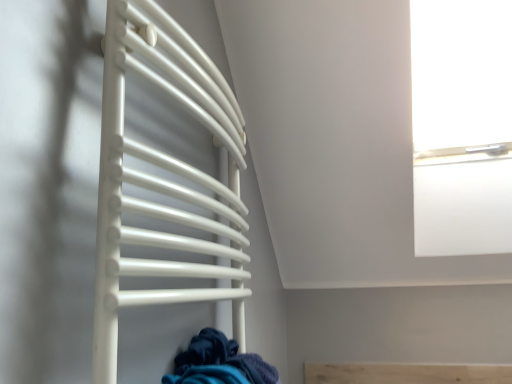
This screenshot has height=384, width=512. I want to click on white glossy towel rack at left, so click(x=164, y=180).

Describe the element at coordinates (164, 180) in the screenshot. The image size is (512, 384). I see `white glossy towel rack at left` at that location.

Identify the location of white glossy towel rack at left. This screenshot has height=384, width=512. (164, 180).